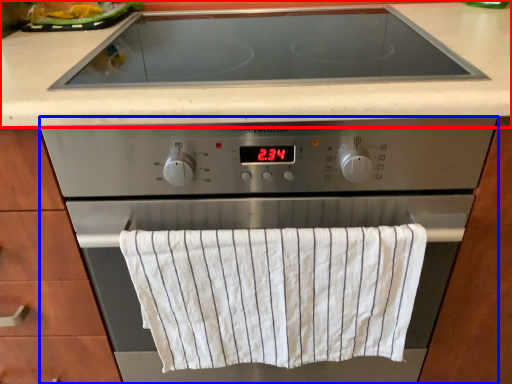
Question: Which object appears farthest to the camera in this image, countertop (highlighted by a red box) or home appliance (highlighted by a blue box)?

Choices:
 (A) countertop
 (B) home appliance

Answer: (A)